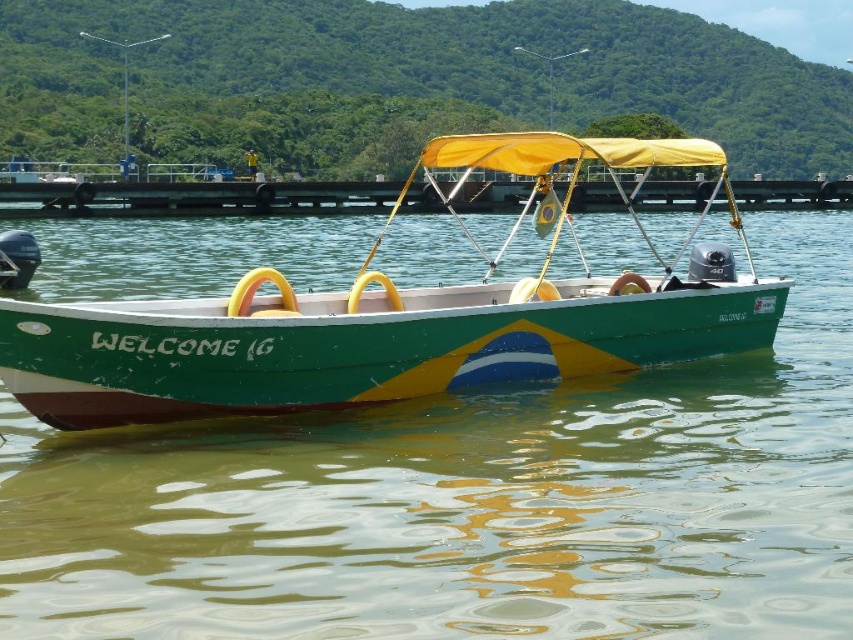
Question: Does green glossy water at center appear on the right side of smooth concrete dock at center?

Choices:
 (A) yes
 (B) no

Answer: (A)

Question: Which object is the closest to the green glossy water at center?

Choices:
 (A) green matte boat at center
 (B) smooth concrete dock at center

Answer: (A)

Question: Which point is farther to the camera?

Choices:
 (A) green glossy water at center
 (B) smooth concrete dock at center

Answer: (B)

Question: Is green glossy water at center below green matte boat at center?

Choices:
 (A) yes
 (B) no

Answer: (A)

Question: Is green glossy water at center thinner than green matte boat at center?

Choices:
 (A) no
 (B) yes

Answer: (A)

Question: Which point is farther to the camera?

Choices:
 (A) smooth concrete dock at center
 (B) green glossy water at center
 (C) green matte boat at center

Answer: (A)